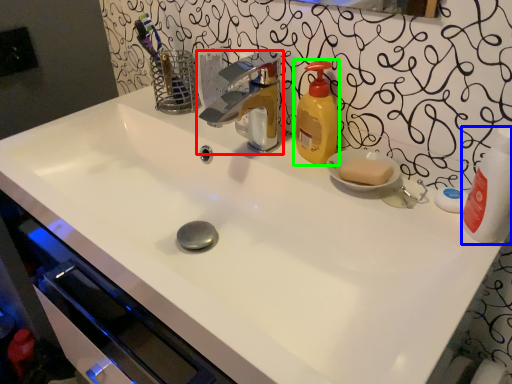
Question: Estimate the real-world distances between objects in this image. Which object is farther from tap (highlighted by a red box), cleaning product (highlighted by a blue box) or soap dispenser (highlighted by a green box)?

Choices:
 (A) cleaning product
 (B) soap dispenser

Answer: (A)